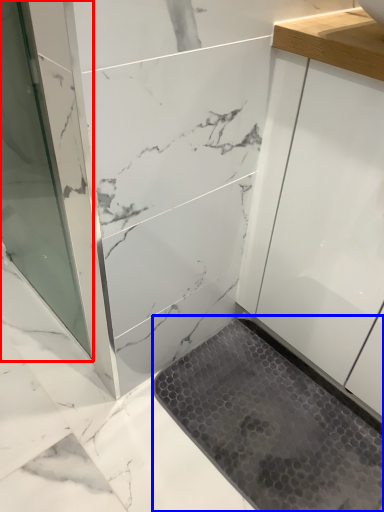
Question: Which object is further to the camera taking this photo, screen door (highlighted by a red box) or bath mat (highlighted by a blue box)?

Choices:
 (A) screen door
 (B) bath mat

Answer: (B)